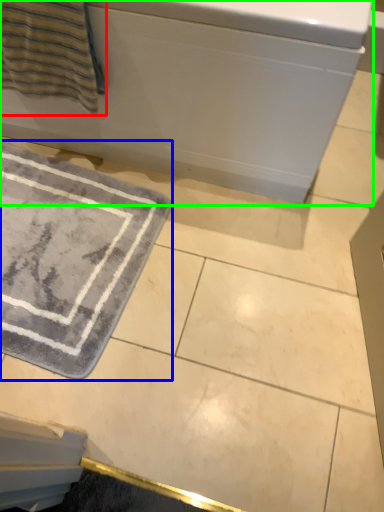
Question: Estimate the real-world distances between objects in this image. Which object is closer to beach towel (highlighted by a red box), bath mat (highlighted by a blue box) or bath (highlighted by a green box)?

Choices:
 (A) bath mat
 (B) bath

Answer: (B)